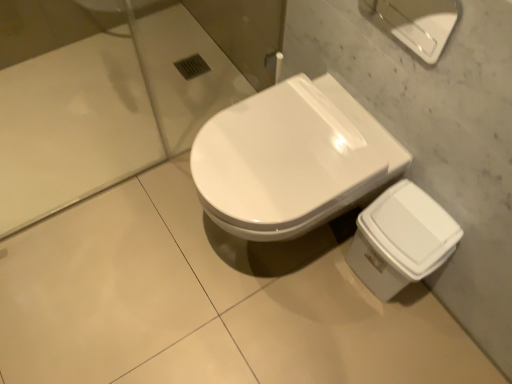
The height and width of the screenshot is (384, 512). Identify the location of free space above white glossy toilet at center (from a real-world perspective). (278, 144).